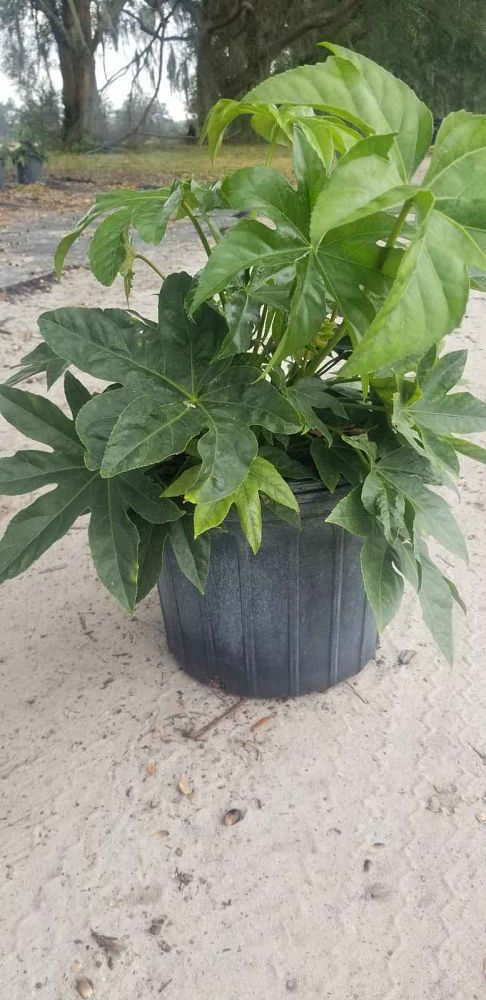
The image size is (486, 1000). What are the coordinates of `plant` in the screenshot? It's located at (367, 292), (188, 384), (395, 483), (24, 144).